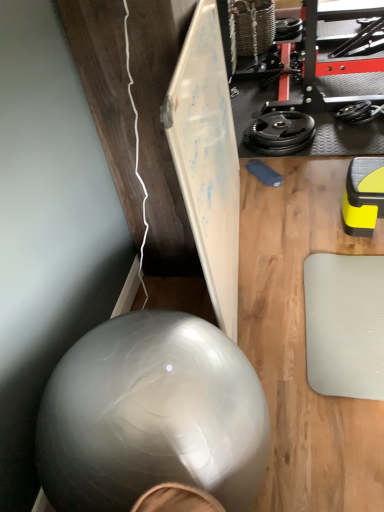
Question: Is black rubber weight at upper right further to camera compared to transparent rubber ball at lower left?

Choices:
 (A) no
 (B) yes

Answer: (B)

Question: Is black rubber weight at upper right beside transparent rubber ball at lower left?

Choices:
 (A) no
 (B) yes

Answer: (A)

Question: From the image's perspective, would you say black rubber weight at upper right is shown under transparent rubber ball at lower left?

Choices:
 (A) no
 (B) yes

Answer: (A)

Question: From a real-world perspective, is black rubber weight at upper right on top of transparent rubber ball at lower left?

Choices:
 (A) yes
 (B) no

Answer: (B)

Question: Would you say black rubber weight at upper right contains transparent rubber ball at lower left?

Choices:
 (A) no
 (B) yes

Answer: (A)

Question: Can you confirm if black rubber weight at upper right is taller than transparent rubber ball at lower left?

Choices:
 (A) yes
 (B) no

Answer: (B)

Question: Is transparent rubber ball at lower left outside black rubber weight at upper right?

Choices:
 (A) no
 (B) yes

Answer: (B)

Question: Does transparent rubber ball at lower left touch black rubber weight at upper right?

Choices:
 (A) yes
 (B) no

Answer: (B)

Question: Is transparent rubber ball at lower left surrounding black rubber weight at upper right?

Choices:
 (A) no
 (B) yes

Answer: (A)

Question: Is transparent rubber ball at lower left facing away from black rubber weight at upper right?

Choices:
 (A) no
 (B) yes

Answer: (A)

Question: From a real-world perspective, is transparent rubber ball at lower left physically below black rubber weight at upper right?

Choices:
 (A) yes
 (B) no

Answer: (B)

Question: Considering the relative sizes of transparent rubber ball at lower left and black rubber weight at upper right in the image provided, is transparent rubber ball at lower left taller than black rubber weight at upper right?

Choices:
 (A) yes
 (B) no

Answer: (A)

Question: Considering the positions of point (208, 372) and point (249, 125), is point (208, 372) closer or farther from the camera than point (249, 125)?

Choices:
 (A) closer
 (B) farther

Answer: (A)